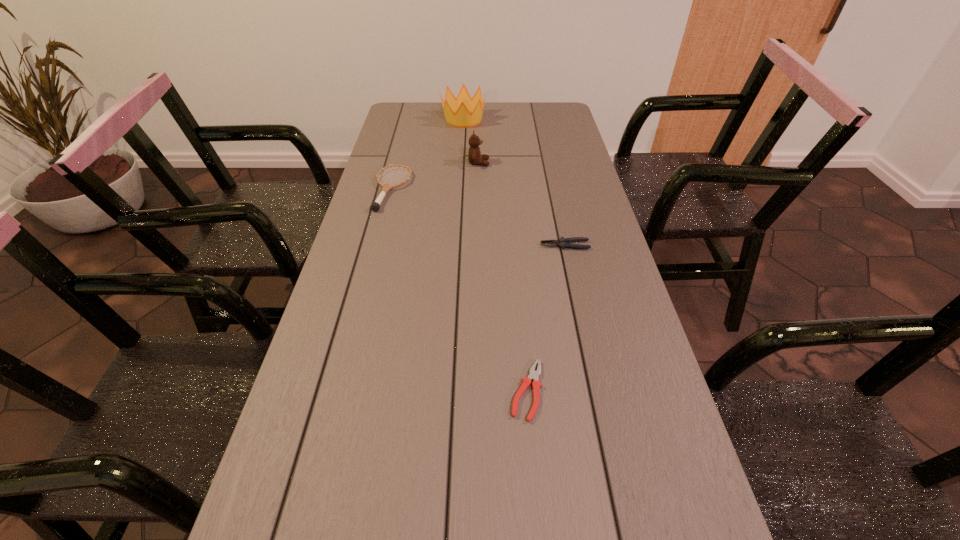
Where is `the farthest object`? The image size is (960, 540). the farthest object is located at coordinates (457, 111).

Find the location of a particular element. Image resolution: width=960 pixels, height=540 pixels. teddy bear is located at coordinates (474, 155).

You are a GUI agent. You are given a task and a screenshot of the screen. Output one action in this format:
    pyautogui.click(x=<x>, y=<y>)
    Task: Click on the third tallest object
    The image size is (960, 540).
    Given the screenshot: What is the action you would take?
    pyautogui.click(x=375, y=206)

At what (x,y) coordinates should I click in order to perform the action: click on the leftmost object. Please return your answer as a coordinate pair (x, y). Image resolution: width=960 pixels, height=540 pixels. Looking at the image, I should click on (375, 206).

Locate an element on the screen. Image resolution: width=960 pixels, height=540 pixels. the second nearest object is located at coordinates (563, 242).

This screenshot has width=960, height=540. I want to click on the right pliers, so click(x=563, y=242).

This screenshot has height=540, width=960. In order to click on the nearest object in this screenshot , I will do `click(533, 375)`.

You are a GUI agent. You are given a task and a screenshot of the screen. Output one action in this format:
    pyautogui.click(x=<x>, y=<y>)
    Task: Click on the shortest object
    The width and height of the screenshot is (960, 540).
    Given the screenshot: What is the action you would take?
    pyautogui.click(x=533, y=375)

Identify the location of vacant region located 0.130m on the right of the farthest object. (518, 120).

Find the location of a particular element. The width and height of the screenshot is (960, 540). free space located 0.330m at the face of the teddy bear is located at coordinates (584, 163).